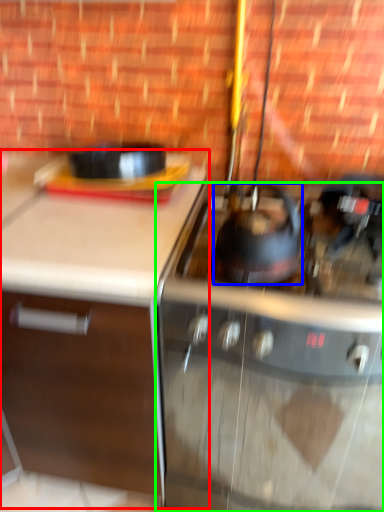
Question: Which is nearer to the cabinetry (highlighted by a red box)? kitchen appliance (highlighted by a blue box) or gas stove (highlighted by a green box).

Choices:
 (A) kitchen appliance
 (B) gas stove

Answer: (B)